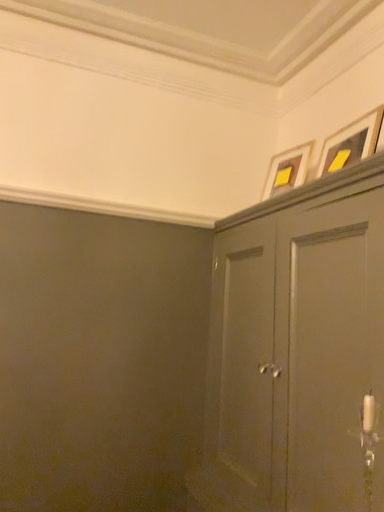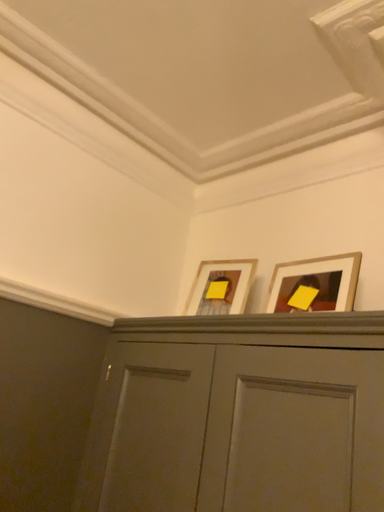
Question: Which way did the camera rotate in the video?

Choices:
 (A) rotated downward
 (B) rotated upward

Answer: (B)